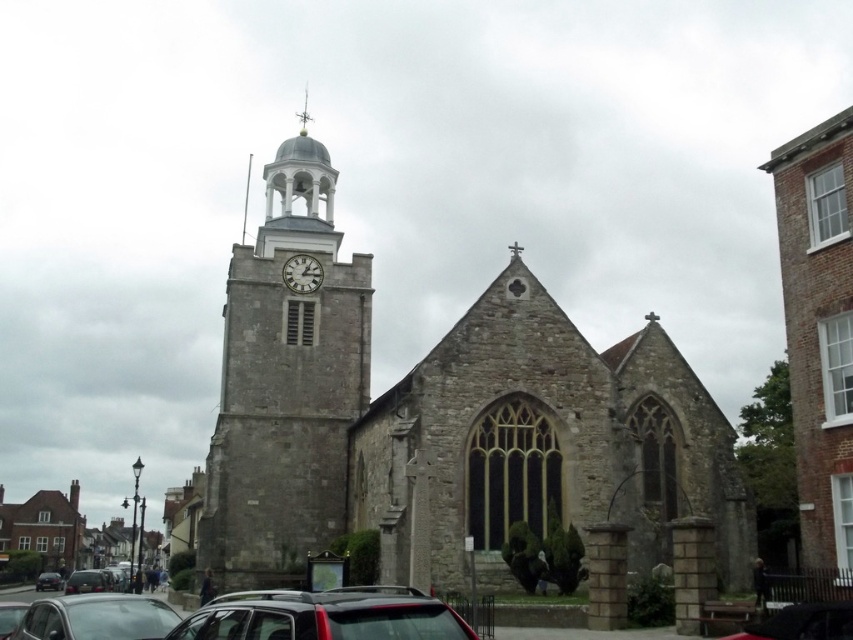
You are a tourist standing in the town square and want to take a photo of both the brown brick church at right and the white stone clock at center. Based on their positions, can you fit both in the frame without moving your camera position?

The brown brick church at right is located above the white stone clock at center, so you can fit both in the frame by adjusting the camera angle to include the church above and the clock below.

You are a photographer planning to take a picture of the historic stone church with its Gothic window and the clock tower. You notice two cars parked at the lower left corner of your frame. Which car, the metallic silver car at lower left or the matte black car at lower left, should you avoid including in your composition to minimize distraction, considering their sizes?

The metallic silver car at lower left has a larger size compared to the matte black car at lower left. To minimize distraction, avoid including the metallic silver car at lower left in your composition since it is bigger and might draw more attention away from the church and clock tower.